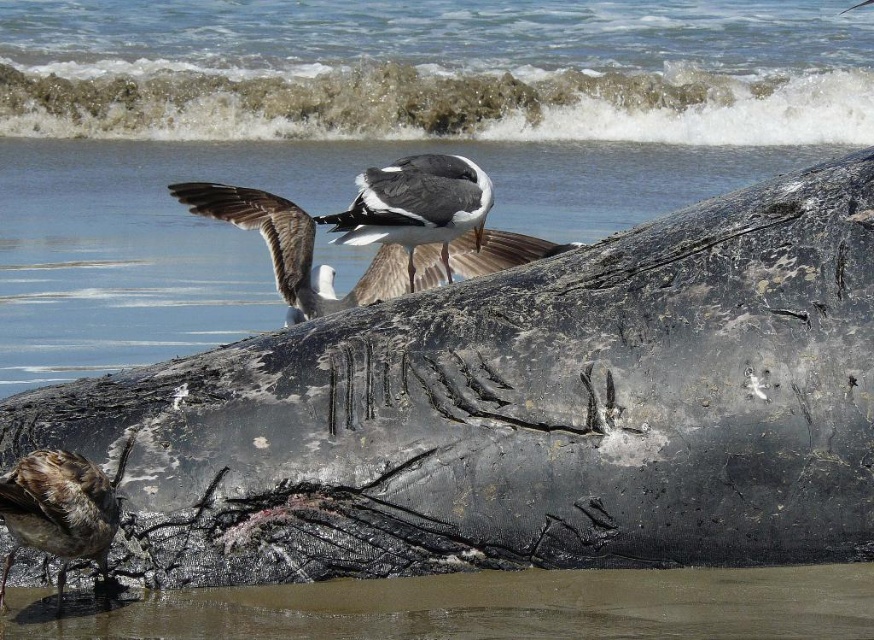
You are standing on the smooth sand beach at lower center and want to reach the brown feathered seagull at center. Which direction should you move to get closer to the seagull?

The smooth sand beach at lower center is in front of the brown feathered seagull at center, so you should move backward to get closer to the seagull.

You are standing on the smooth sand beach at lower center and want to reach the brown feathered seagull at center. Which direction should you move to get closer to the seagull?

You should move towards the center from the smooth sand beach at lower center to reach the brown feathered seagull at center.